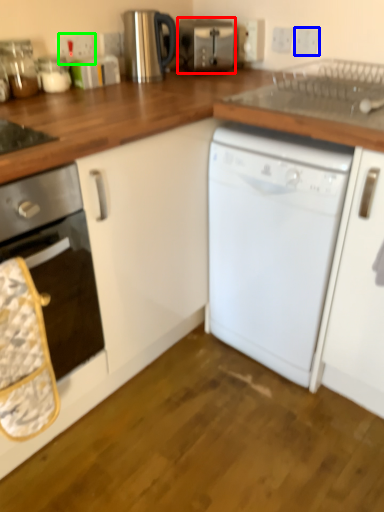
Question: Which object is the closest to the toaster (highlighted by a red box)? Choose among these: electric outlet (highlighted by a blue box) or electric outlet (highlighted by a green box).

Choices:
 (A) electric outlet
 (B) electric outlet

Answer: (A)